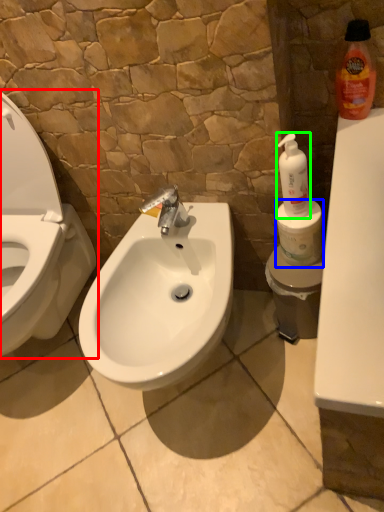
Question: Based on their relative distances, which object is nearer to toilet (highlighted by a red box)? Choose from toilet paper (highlighted by a blue box) and cleaning product (highlighted by a green box).

Choices:
 (A) toilet paper
 (B) cleaning product

Answer: (A)